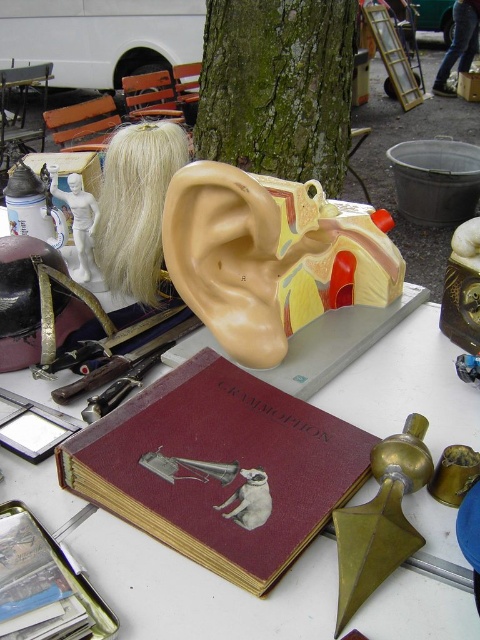
From the picture: Is beige rubber ear at center further to camera compared to green rough bark tree at center?

No.

Who is more distant from viewer, (223,348) or (256,138)?

Positioned behind is point (256,138).

Locate an element on the screen. The image size is (480, 640). beige rubber ear at center is located at coordinates (268, 257).

Locate an element on the screen. beige rubber ear at center is located at coordinates click(x=268, y=257).

Can you confirm if maroon leather book at center is taller than beige rubber ear at center?

No.

Who is positioned more to the right, maroon leather book at center or beige rubber ear at center?

beige rubber ear at center

This screenshot has width=480, height=640. What do you see at coordinates (219, 465) in the screenshot?
I see `maroon leather book at center` at bounding box center [219, 465].

Identify the location of maroon leather book at center. This screenshot has height=640, width=480. (219, 465).

Is point (371, 438) farther from camera compared to point (235, 128)?

No, (371, 438) is in front of (235, 128).

Which of these two, maroon leather book at center or green rough bark tree at center, stands taller?

Standing taller between the two is green rough bark tree at center.

Does point (206, 508) come farther from viewer compared to point (300, 38)?

That is False.

Locate an element on the screen. maroon leather book at center is located at coordinates (219, 465).